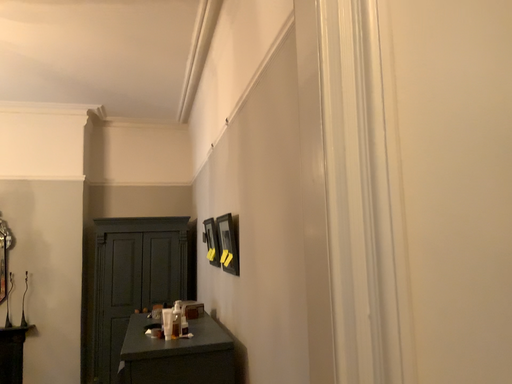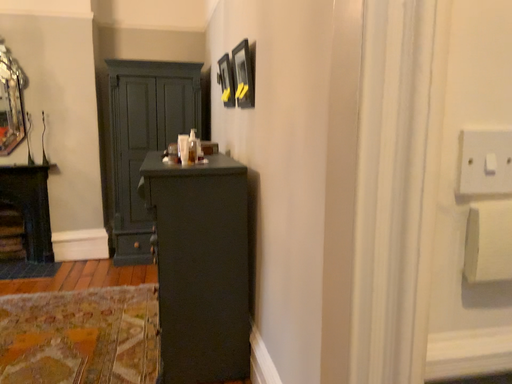
Question: How did the camera likely rotate when shooting the video?

Choices:
 (A) rotated upward
 (B) rotated downward

Answer: (B)